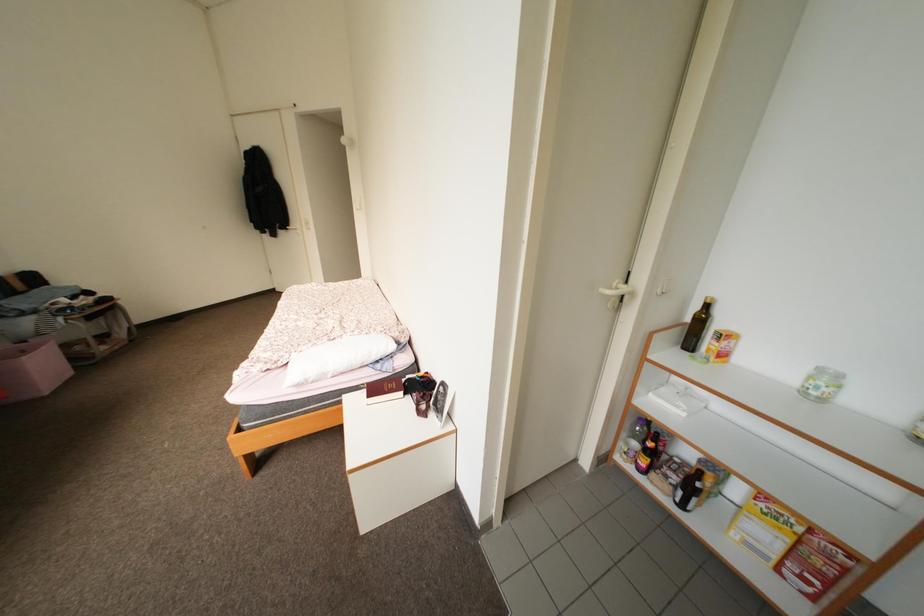
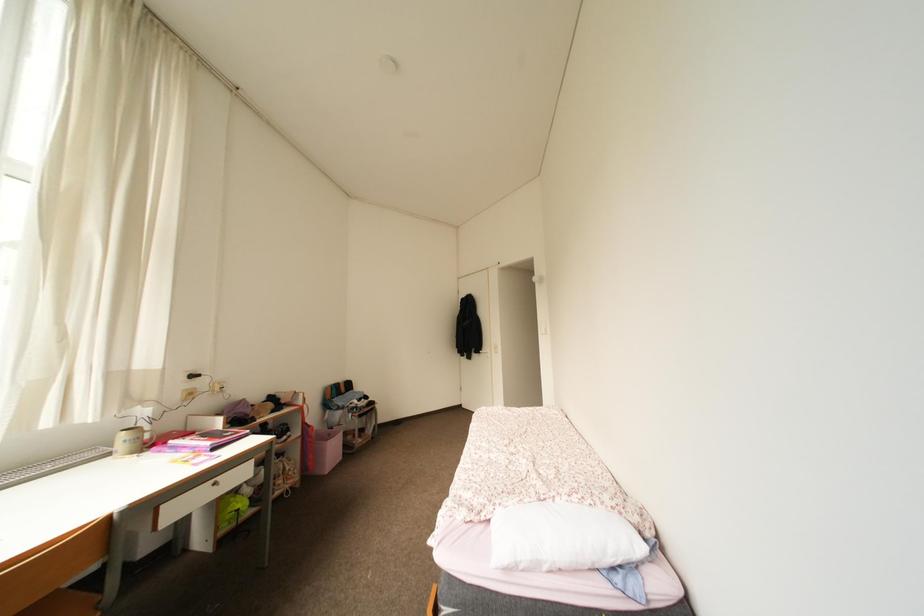
How did the camera likely rotate?

The rotation direction of the camera is left-up.